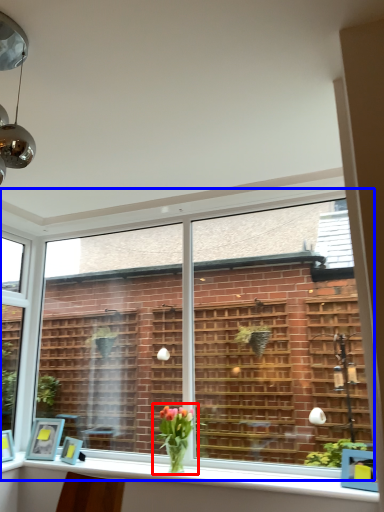
Question: Which object appears farthest to the camera in this image, houseplant (highlighted by a red box) or window (highlighted by a blue box)?

Choices:
 (A) houseplant
 (B) window

Answer: (A)